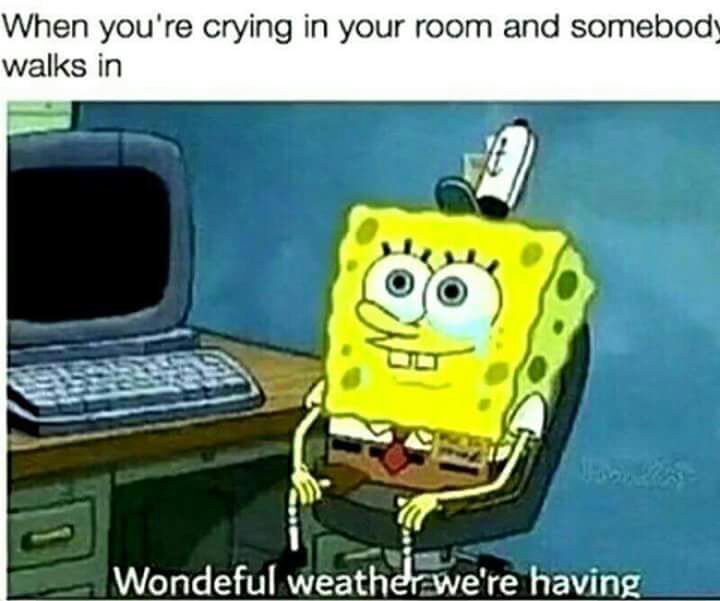
Image resolution: width=720 pixels, height=601 pixels. Identify the location of blue wall. (592, 188).